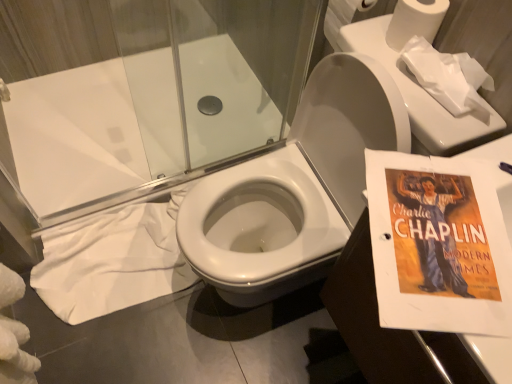
The width and height of the screenshot is (512, 384). What are the coordinates of `vacant area that is in front of white matte toilet paper at upper right, which is the 2th toilet paper from back to front` in the screenshot? It's located at (408, 91).